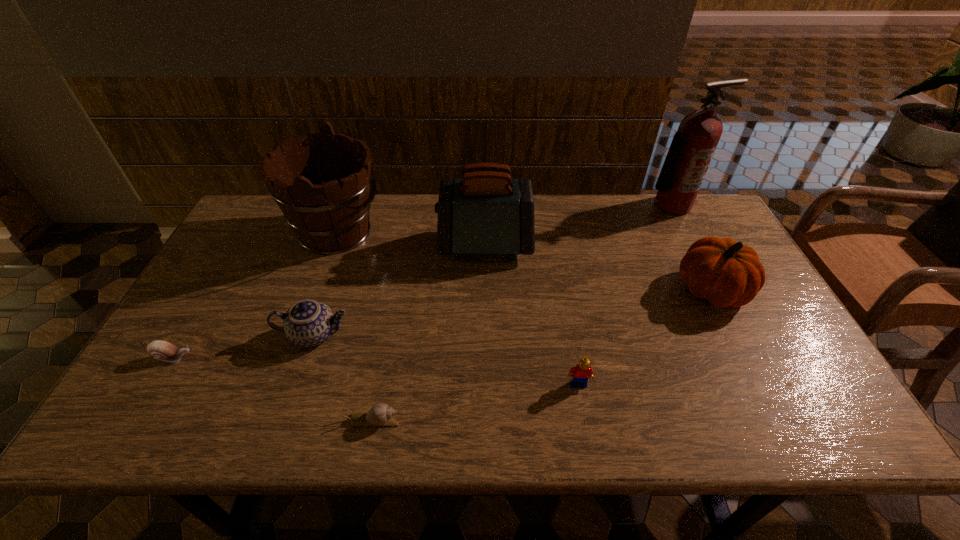
This screenshot has width=960, height=540. I want to click on free space at the near edge, so click(x=246, y=436).

Where is `free space at the right edge`? free space at the right edge is located at coordinates (683, 238).

Locate an element on the screen. This screenshot has width=960, height=540. vacant space at the far left corner is located at coordinates (279, 213).

Locate an element on the screen. free space at the far right corner of the desktop is located at coordinates (692, 222).

The width and height of the screenshot is (960, 540). In the image, there is a desktop. Identify the location of vacant space at the near right corner. (818, 414).

Where is `vacant area that lies between the pumpkin and the nearest object`? The height and width of the screenshot is (540, 960). vacant area that lies between the pumpkin and the nearest object is located at coordinates pos(542,355).

I want to click on free spot between the wine bucket and the fourth tallest object, so click(524, 261).

Locate an element on the screen. This screenshot has width=960, height=540. vacant area that lies between the fourth shortest object and the nearest object is located at coordinates (344, 377).

The width and height of the screenshot is (960, 540). I want to click on unoccupied area between the leftmost object and the fifth object from left to right, so click(329, 301).

The height and width of the screenshot is (540, 960). I want to click on free space between the chinaware and the left escargot, so tap(244, 346).